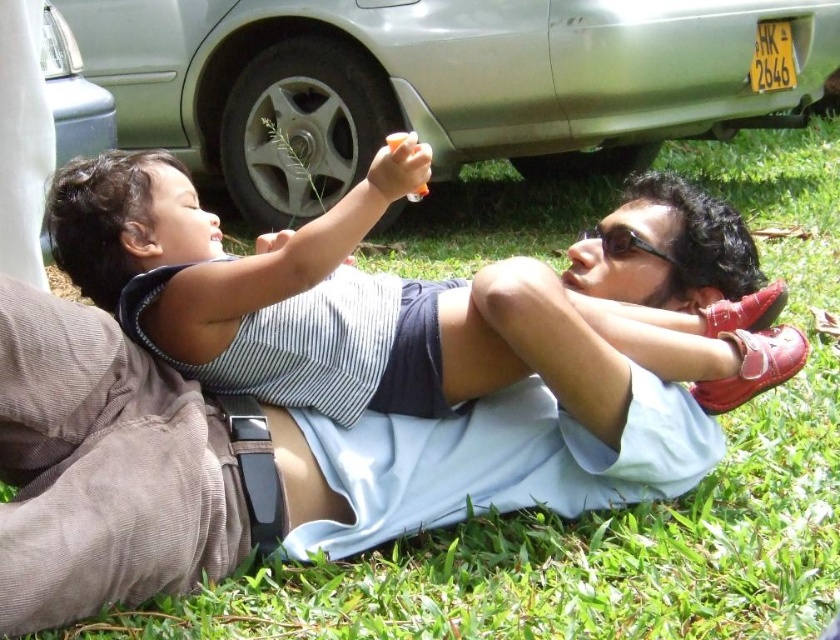
You are a photographer planning to take a portrait of the blue fabric shirt at center and the silver metallic car at upper center. Which object should you focus on first if you want to capture both in sharp focus, considering their heights?

The blue fabric shirt at center has a lesser height compared to the silver metallic car at upper center. To capture both in sharp focus, you should focus on the silver metallic car at upper center first since it is taller and likely further away, ensuring depth of field covers both subjects.

You are standing at the edge of the grassy area where the two people are lying. You want to toss a small ball to the silver metallic car at upper center without disturbing the people. The ball travels in a straight line. Is the path clear for the ball to reach the car?

The silver metallic car at upper center is 3.65 meters away from the viewer. Since the two people are lying on the grassy area closer to you, the ball might hit them before reaching the car. Therefore, the path is not clear.

You are a photographer standing in the scene and want to take a photo of the silver metallic car at upper center and the black plastic goggles at upper center. Which object should you focus on first if you want to ensure both are in focus without moving the camera?

You should focus on the silver metallic car at upper center first because it is positioned over the black plastic goggles at upper center, meaning it is closer to the camera. By focusing on the closer object, the farther one may still be within the depth of field, ensuring both are in focus.